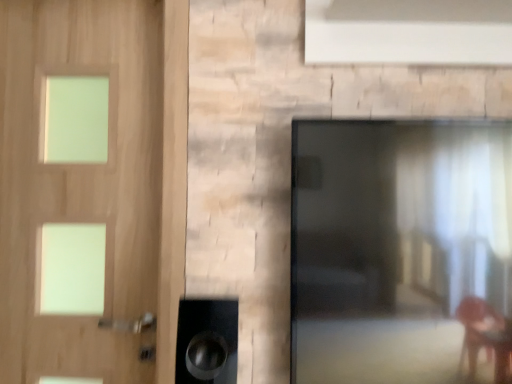
Question: Does point (376, 299) appear closer or farther from the camera than point (159, 34)?

Choices:
 (A) closer
 (B) farther

Answer: (A)

Question: Which is correct: black glossy screen door at right is inside light wood door at left, or outside of it?

Choices:
 (A) outside
 (B) inside

Answer: (A)

Question: Based on their positions, is black glossy screen door at right located to the left or right of light wood door at left?

Choices:
 (A) right
 (B) left

Answer: (A)

Question: Considering their positions, is light wood door at left located in front of or behind black glossy screen door at right?

Choices:
 (A) behind
 (B) front

Answer: (A)

Question: Is light wood door at left inside the boundaries of black glossy screen door at right, or outside?

Choices:
 (A) inside
 (B) outside

Answer: (B)

Question: In terms of width, does light wood door at left look wider or thinner when compared to black glossy screen door at right?

Choices:
 (A) wide
 (B) thin

Answer: (B)

Question: From their relative heights in the image, would you say light wood door at left is taller or shorter than black glossy screen door at right?

Choices:
 (A) tall
 (B) short

Answer: (A)